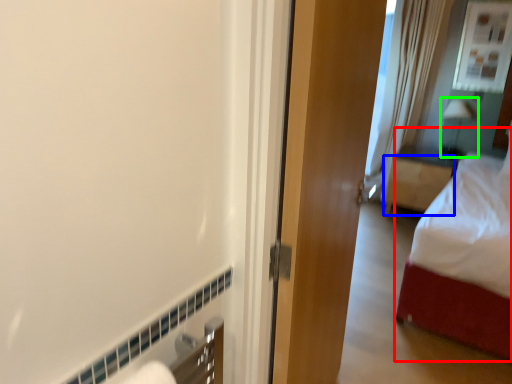
Question: Which object is positioned closest to bed (highlighted by a red box)? Select from furniture (highlighted by a blue box) and lamp (highlighted by a green box).

Choices:
 (A) furniture
 (B) lamp

Answer: (A)